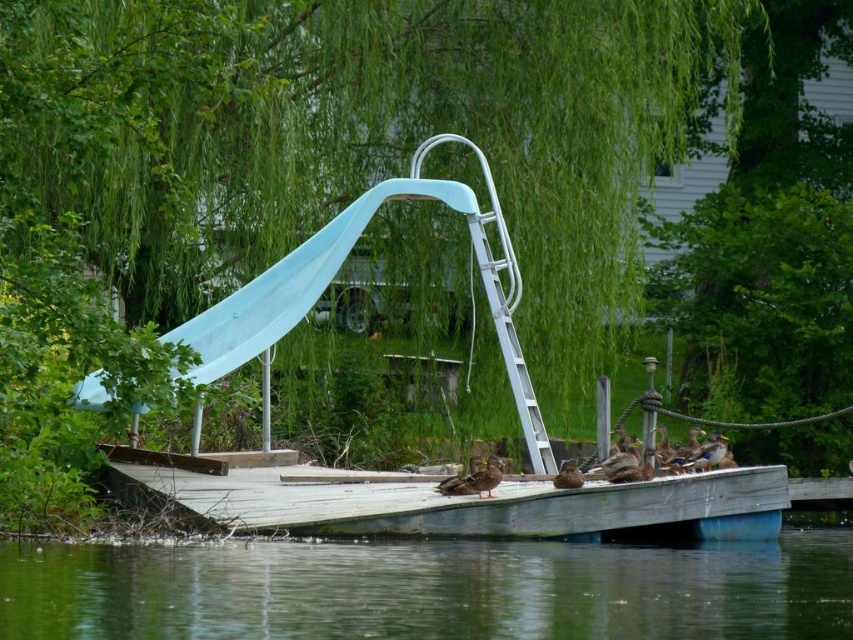
You are standing on the dock and want to locate the green water at lower center. According to the coordinates provided, where exactly should you look?

The green water at lower center is located at coordinates point (430, 589).

You are standing on the wooden dock at lower center and want to jump into the green water at lower center. Based on their sizes, which one covers more area in the image?

The green water at lower center covers more area in the image than the wooden dock at lower center because the green water at lower center is larger in size than the wooden dock at lower center.

You are standing on the dock and want to walk from point A to point B. Point A is at coordinates point (555, 598) and point B is at coordinates point (456, 193). Since you can only move forward, will you be able to see point B from point A?

Point point (555, 598) is in front of point point (456, 193), so yes, you can see point B from point A because it is directly in front of you.